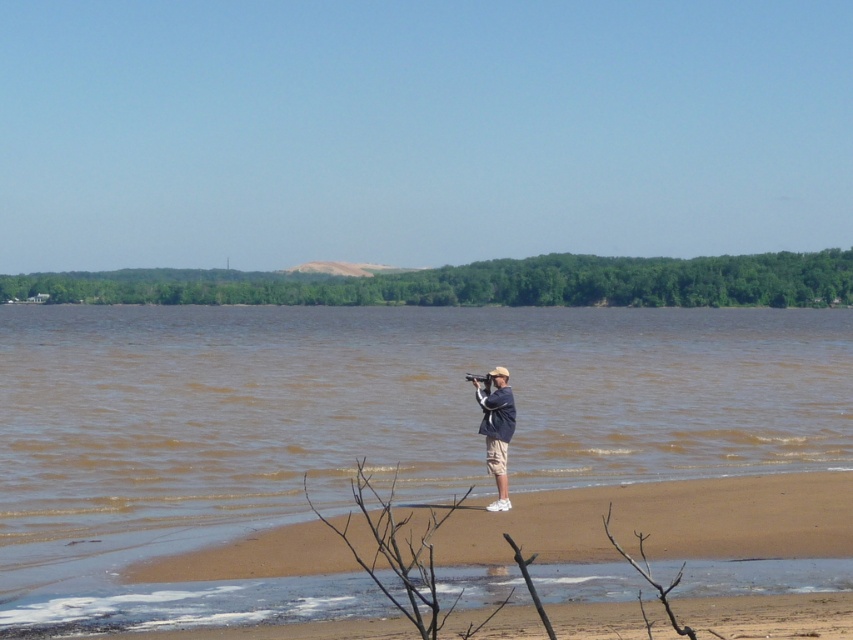
Which is in front, point (314, 522) or point (488, 461)?

Point (488, 461) is in front.

Measure the distance between brown sandy beach at lower center and light blue denim shirt at center.

brown sandy beach at lower center is 6.21 feet from light blue denim shirt at center.

Find the location of a particular element. brown sandy beach at lower center is located at coordinates (663, 520).

Find the location of a particular element. This screenshot has height=640, width=853. brown sandy beach at lower center is located at coordinates (663, 520).